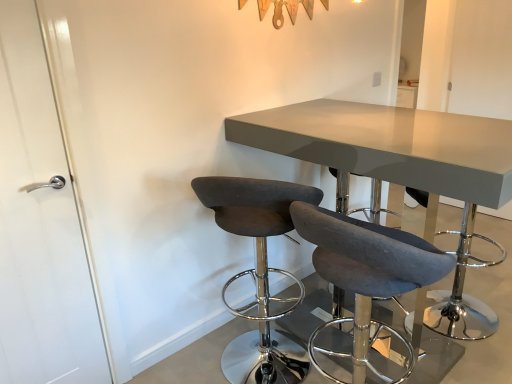
This screenshot has height=384, width=512. In order to click on gray fabric bar stool at center in this screenshot , I will do `click(462, 292)`.

Identify the location of dark gray fabric stool at center, the first chair positioned from the left. (258, 270).

At what (x,y) coordinates should I click in order to perform the action: click on matte gray table at center. Please return your answer as a coordinate pair (x, y). Image resolution: width=512 pixels, height=384 pixels. Looking at the image, I should click on (389, 146).

Find the location of a particular element. This screenshot has width=512, height=384. gray fabric bar stool at center is located at coordinates (462, 292).

Is matte gray table at center aimed at dark gray fabric stool at center, the first chair viewed from the right?

No, matte gray table at center is not facing towards dark gray fabric stool at center, the first chair viewed from the right.

Is point (447, 181) less distant than point (356, 340)?

Yes, it is.

Is matte gray table at center positioned far away from dark gray fabric stool at center, the first chair viewed from the right?

matte gray table at center is near dark gray fabric stool at center, the first chair viewed from the right, not far away.

From the image's perspective, is matte gray table at center under dark gray fabric stool at center, the first chair viewed from the right?

Actually, matte gray table at center appears above dark gray fabric stool at center, the first chair viewed from the right, in the image.

From a real-world perspective, who is located higher, white glossy door at left or gray fabric bar stool at center?

white glossy door at left is physically above.

How far apart are white glossy door at left and gray fabric bar stool at center?

white glossy door at left is 6.33 feet away from gray fabric bar stool at center.

Looking at their sizes, would you say white glossy door at left is wider or thinner than gray fabric bar stool at center?

In the image, white glossy door at left appears to be more narrow than gray fabric bar stool at center.

Between white glossy door at left and gray fabric bar stool at center, which one appears on the right side from the viewer's perspective?

gray fabric bar stool at center is more to the right.

Is dark gray fabric stool at center, the second chair viewed from the right, thinner than white glossy door at left?

No, dark gray fabric stool at center, the second chair viewed from the right, is not thinner than white glossy door at left.

Is point (270, 196) in front of point (59, 149)?

Yes, point (270, 196) is closer to viewer.

From a real-world perspective, who is located higher, dark gray fabric stool at center, the second chair viewed from the right, or white glossy door at left?

From a 3D spatial view, white glossy door at left is above.

Are dark gray fabric stool at center, the first chair positioned from the left, and white glossy door at left making contact?

dark gray fabric stool at center, the first chair positioned from the left, and white glossy door at left are not in contact.

From a real-world perspective, starting from the matte gray table at center, which chair is the 1st one below it? Please provide its 2D coordinates.

[(258, 270)]

In the image, is matte gray table at center positioned in front of or behind dark gray fabric stool at center, the first chair positioned from the left?

matte gray table at center is in front of dark gray fabric stool at center, the first chair positioned from the left.

From the picture: From the image's perspective, which one is positioned lower, matte gray table at center or dark gray fabric stool at center, the first chair positioned from the left?

dark gray fabric stool at center, the first chair positioned from the left.

Considering the relative sizes of matte gray table at center and dark gray fabric stool at center, the first chair positioned from the left, in the image provided, is matte gray table at center wider than dark gray fabric stool at center, the first chair positioned from the left,?

Yes.

Looking at this image, in the image, is matte gray table at center positioned in front of or behind white glossy door at left?

Clearly, matte gray table at center is in front of white glossy door at left.

The height and width of the screenshot is (384, 512). In order to click on door above the matte gray table at center (from the image's perspective) in this screenshot , I will do `click(39, 225)`.

Considering the sizes of objects matte gray table at center and white glossy door at left in the image provided, who is taller, matte gray table at center or white glossy door at left?

white glossy door at left.

Considering the positions of point (492, 193) and point (58, 281), is point (492, 193) closer or farther from the camera than point (58, 281)?

Point (492, 193) is positioned closer to the camera compared to point (58, 281).

Between dark gray fabric stool at center, the second chair viewed from the right, and dark gray fabric stool at center, the first chair viewed from the right, which one has larger width?

Wider between the two is dark gray fabric stool at center, the second chair viewed from the right.

Is dark gray fabric stool at center, the first chair positioned from the left, placed right next to dark gray fabric stool at center, the 2th chair from the left?

No, dark gray fabric stool at center, the first chair positioned from the left, is not making contact with dark gray fabric stool at center, the 2th chair from the left.

From a real-world perspective, is dark gray fabric stool at center, the second chair viewed from the right, physically located above or below dark gray fabric stool at center, the 2th chair from the left?

In terms of real-world spatial position, dark gray fabric stool at center, the second chair viewed from the right, is above dark gray fabric stool at center, the 2th chair from the left.

Is point (436, 273) positioned behind point (391, 122)?

No, (436, 273) is closer to viewer.

Is dark gray fabric stool at center, the 2th chair from the left, positioned behind matte gray table at center?

No, dark gray fabric stool at center, the 2th chair from the left, is closer to the viewer.

Locate an element on the screen. table positioned vertically above the dark gray fabric stool at center, the first chair viewed from the right (from a real-world perspective) is located at coordinates (389, 146).

Would you say dark gray fabric stool at center, the 2th chair from the left, is outside matte gray table at center?

No, dark gray fabric stool at center, the 2th chair from the left, is not outside of matte gray table at center.

From the image's perspective, starting from the matte gray table at center, which chair is the 2nd one below? Please provide its 2D coordinates.

[(367, 273)]

You are a GUI agent. You are given a task and a screenshot of the screen. Output one action in this format:
    pyautogui.click(x=<x>, y=<y>)
    Task: Click on the bar stool behind the white glossy door at left
    Image resolution: width=512 pixels, height=384 pixels.
    Given the screenshot: What is the action you would take?
    pyautogui.click(x=462, y=292)

Considering their positions, is white glossy door at left positioned closer to matte gray table at center than dark gray fabric stool at center, the first chair positioned from the left?

dark gray fabric stool at center, the first chair positioned from the left.

From the image, which object appears to be nearer to matte gray table at center, gray fabric bar stool at center or dark gray fabric stool at center, the 2th chair from the left?

dark gray fabric stool at center, the 2th chair from the left, lies closer to matte gray table at center than the other object.

Based on their spatial positions, is dark gray fabric stool at center, the first chair viewed from the right, or matte gray table at center closer to dark gray fabric stool at center, the second chair viewed from the right?

dark gray fabric stool at center, the first chair viewed from the right.

Estimate the real-world distances between objects in this image. Which object is further from dark gray fabric stool at center, the first chair viewed from the right, gray fabric bar stool at center or dark gray fabric stool at center, the first chair positioned from the left?

Among the two, gray fabric bar stool at center is located further to dark gray fabric stool at center, the first chair viewed from the right.

Based on their spatial positions, is dark gray fabric stool at center, the first chair positioned from the left, or dark gray fabric stool at center, the 2th chair from the left, further from white glossy door at left?

The object further to white glossy door at left is dark gray fabric stool at center, the 2th chair from the left.

Estimate the real-world distances between objects in this image. Which object is further from dark gray fabric stool at center, the 2th chair from the left, matte gray table at center or gray fabric bar stool at center?

The object further to dark gray fabric stool at center, the 2th chair from the left, is gray fabric bar stool at center.

Which object lies nearer to the anchor point dark gray fabric stool at center, the second chair viewed from the right, gray fabric bar stool at center or dark gray fabric stool at center, the first chair viewed from the right?

dark gray fabric stool at center, the first chair viewed from the right, lies closer to dark gray fabric stool at center, the second chair viewed from the right, than the other object.

Looking at the image, which one is located further to dark gray fabric stool at center, the 2th chair from the left, white glossy door at left or gray fabric bar stool at center?

gray fabric bar stool at center is positioned further to the anchor dark gray fabric stool at center, the 2th chair from the left.

You are a GUI agent. You are given a task and a screenshot of the screen. Output one action in this format:
    pyautogui.click(x=<x>, y=<y>)
    Task: Click on the chair located between white glossy door at left and dark gray fabric stool at center, the first chair viewed from the right, in the left-right direction
    
    Given the screenshot: What is the action you would take?
    pyautogui.click(x=258, y=270)

I want to click on table located between dark gray fabric stool at center, the first chair viewed from the right, and gray fabric bar stool at center in the left-right direction, so click(389, 146).

This screenshot has height=384, width=512. What are the coordinates of `table between dark gray fabric stool at center, the first chair positioned from the left, and gray fabric bar stool at center from left to right` in the screenshot? It's located at (389, 146).

The height and width of the screenshot is (384, 512). What are the coordinates of `chair between dark gray fabric stool at center, the second chair viewed from the right, and gray fabric bar stool at center from left to right` in the screenshot? It's located at (367, 273).